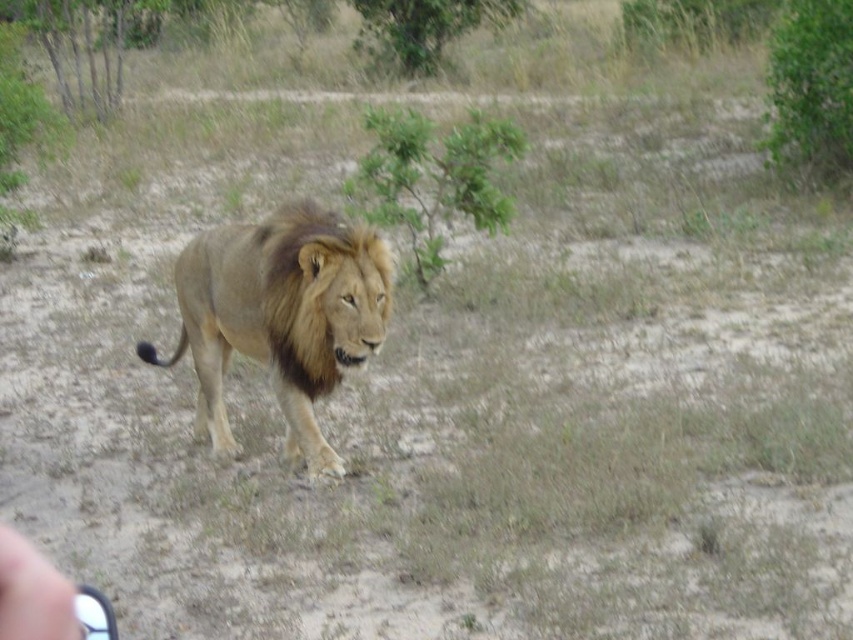
Question: Does golden brown fur lion at center lie in front of brown fuzzy mane at center?

Choices:
 (A) no
 (B) yes

Answer: (A)

Question: Where is golden brown fur lion at center located in relation to brown fuzzy mane at center in the image?

Choices:
 (A) above
 (B) below

Answer: (B)

Question: Is golden brown fur lion at center below brown fuzzy mane at center?

Choices:
 (A) no
 (B) yes

Answer: (B)

Question: Which point appears farthest from the camera in this image?

Choices:
 (A) (357, 262)
 (B) (308, 256)

Answer: (A)

Question: Which point appears closest to the camera in this image?

Choices:
 (A) (360, 266)
 (B) (322, 362)

Answer: (A)

Question: Which point is closer to the camera?

Choices:
 (A) (263, 260)
 (B) (285, 244)

Answer: (B)